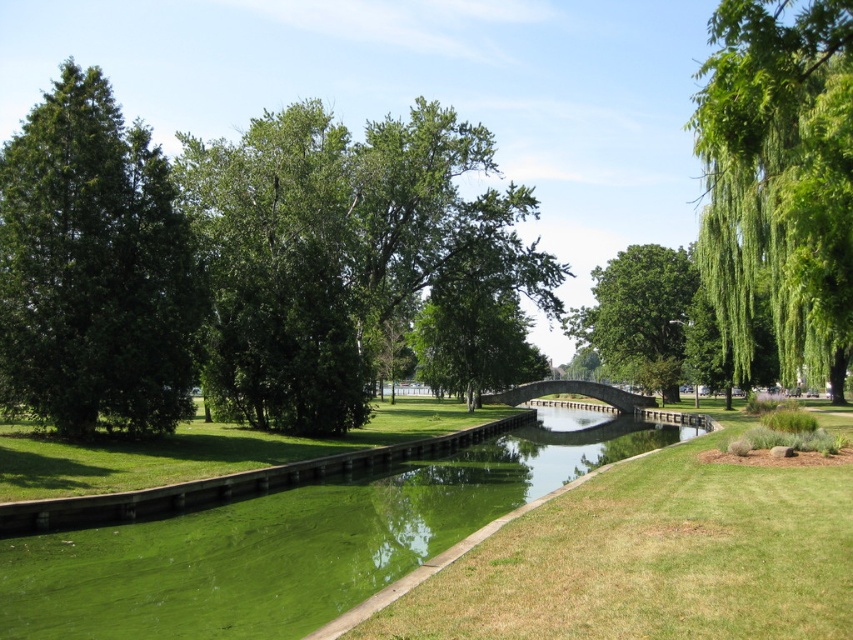
You are a bird looking for a nesting spot. You see the green glossy tree at left and the green leafy tree at right. Which tree is taller and better for nesting?

The green leafy tree at right is taller than the green glossy tree at left, so it would be better for nesting.